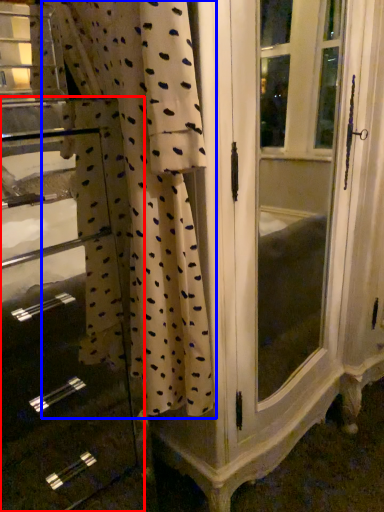
Question: Which of the following is the farthest to the observer, file cabinet (highlighted by a red box) or curtain (highlighted by a blue box)?

Choices:
 (A) file cabinet
 (B) curtain

Answer: (A)